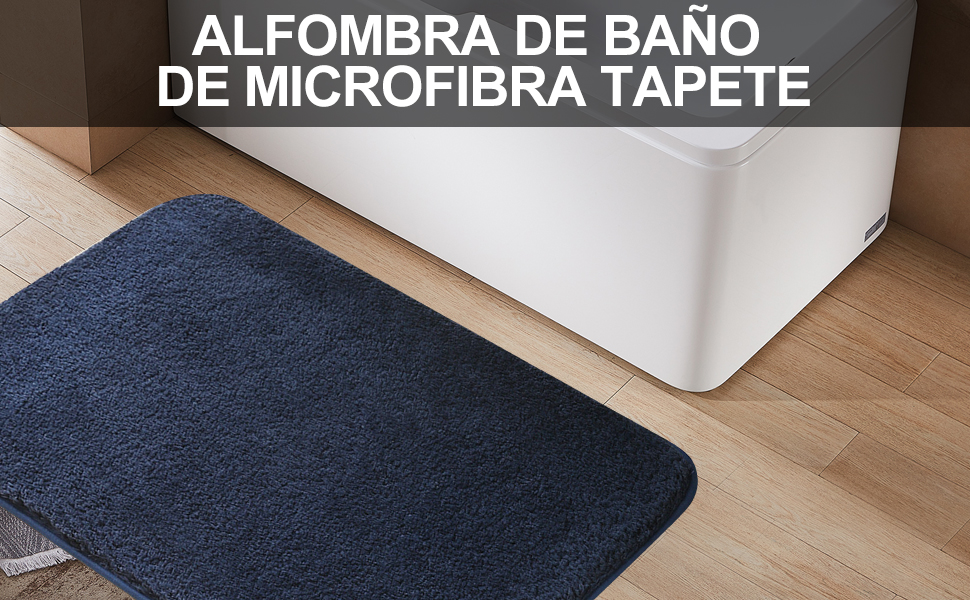
You are a GUI agent. You are given a task and a screenshot of the screen. Output one action in this format:
    pyautogui.click(x=<x>, y=<y>)
    Task: Click on the place to dry feet
    The width and height of the screenshot is (970, 600).
    Given the screenshot: What is the action you would take?
    click(x=301, y=434)